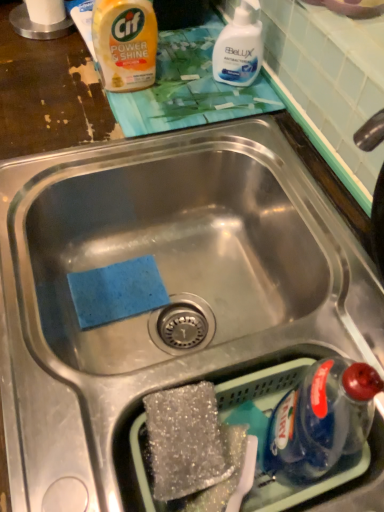
Question: From the image's perspective, is yellow plastic bottle at upper left located above or below white glossy liquid at upper center?

Choices:
 (A) below
 (B) above

Answer: (B)

Question: Would you say yellow plastic bottle at upper left is to the left or to the right of white glossy liquid at upper center in the picture?

Choices:
 (A) right
 (B) left

Answer: (B)

Question: Considering the real-world distances, which object is closest to the white glossy liquid at upper center?

Choices:
 (A) sparkly silver sponge at bottom center
 (B) blue translucent bottle at lower right
 (C) yellow plastic bottle at upper left

Answer: (C)

Question: Estimate the real-world distances between objects in this image. Which object is farther from the sparkly silver sponge at bottom center?

Choices:
 (A) blue translucent bottle at lower right
 (B) yellow plastic bottle at upper left
 (C) white glossy liquid at upper center

Answer: (C)